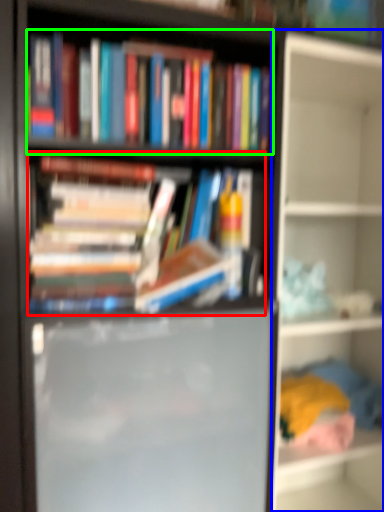
Question: Which object is positioned farthest from book (highlighted by a red box)? Select from shelf (highlighted by a blue box) and book (highlighted by a green box).

Choices:
 (A) shelf
 (B) book

Answer: (A)